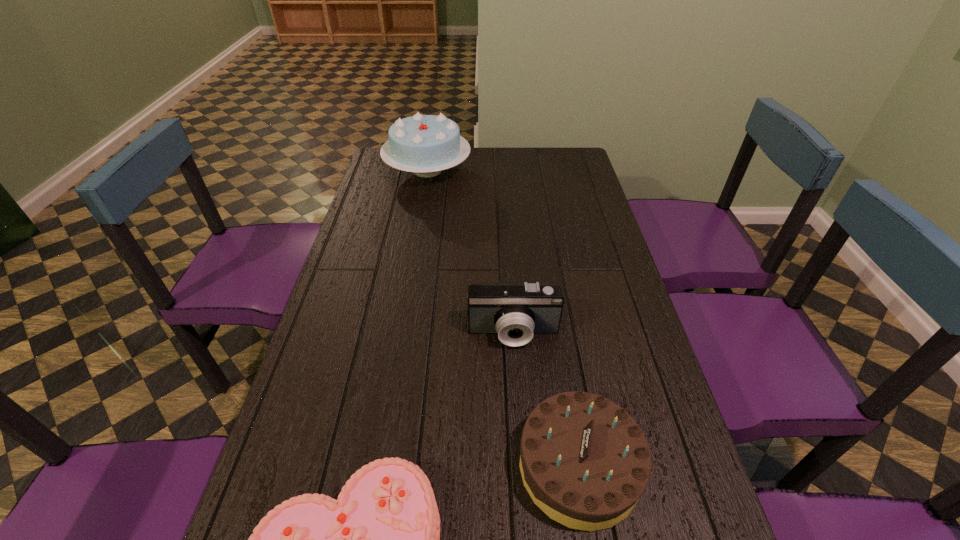
This screenshot has width=960, height=540. Find the location of `the left birthday cake`. the left birthday cake is located at coordinates coord(423,144).

The image size is (960, 540). I want to click on the farthest object, so click(423, 144).

Find the location of a particular element. The height and width of the screenshot is (540, 960). camcorder is located at coordinates (515, 311).

Where is `the right birthday cake`? This screenshot has height=540, width=960. the right birthday cake is located at coordinates (584, 461).

The height and width of the screenshot is (540, 960). Identify the location of the shorter birthday cake. (584, 461).

Image resolution: width=960 pixels, height=540 pixels. Find the location of `vacant space located 0.400m on the right of the tallest object`. vacant space located 0.400m on the right of the tallest object is located at coordinates (568, 170).

Identify the location of vacant region located 0.090m on the lens of the camcorder. (516, 380).

At what (x,y) coordinates should I click in order to perform the action: click on vacant space located on the front-facing side of the nearer birthday cake. Please return your answer as a coordinate pair (x, y). This screenshot has height=540, width=960. Looking at the image, I should click on (385, 467).

The image size is (960, 540). Identify the location of vacant position located on the front-facing side of the nearer birthday cake. (413, 467).

Locate an element on the screen. This screenshot has width=960, height=540. free space located on the front-facing side of the nearer birthday cake is located at coordinates (337, 467).